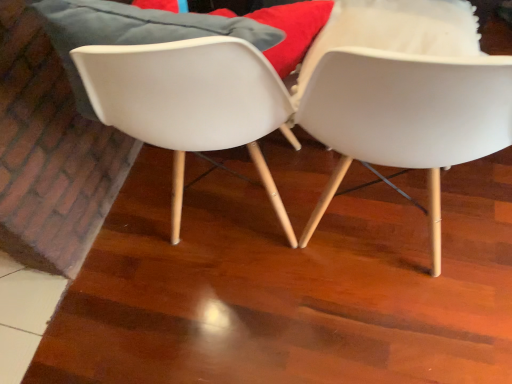
Identify the location of vacant space underneath white plastic chair at center, the first chair viewed from the left (from a real-world perspective). 246,209.